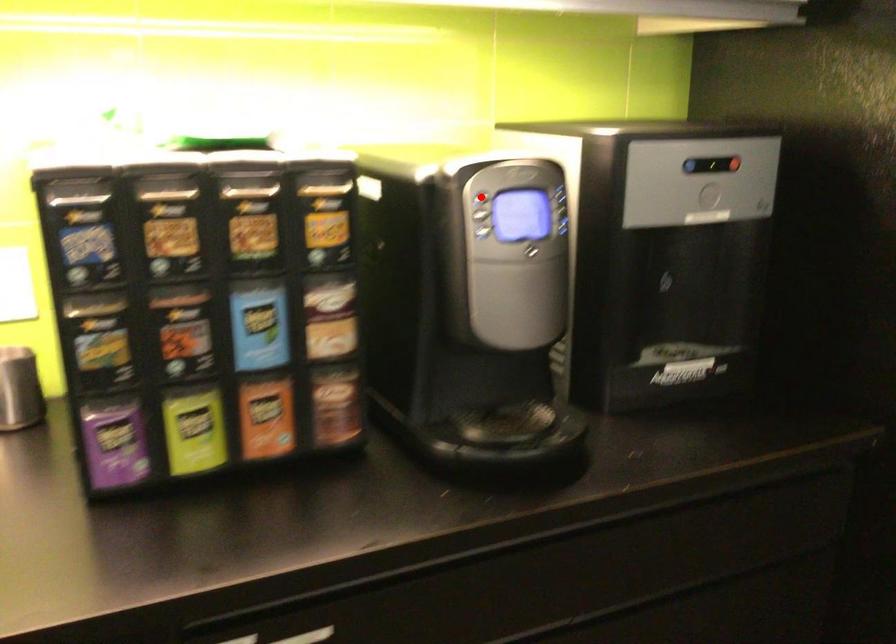
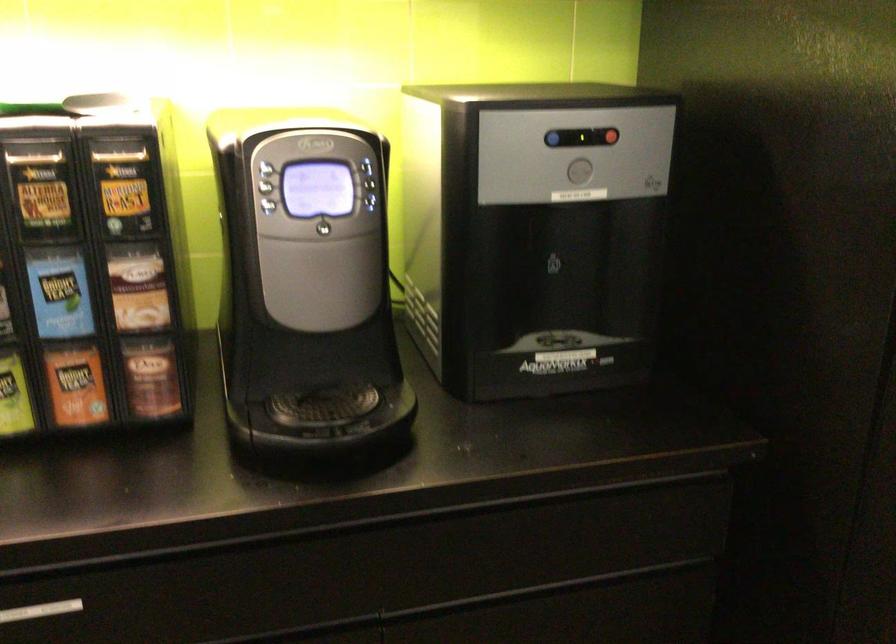
Where in the second image is the point corresponding to the highlighted location from the first image?

(263, 169)